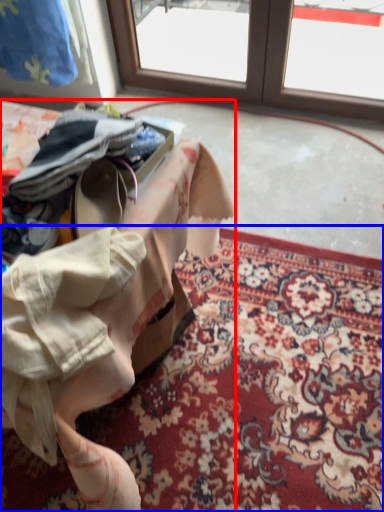
Question: Which object is closer to the camera taking this photo, table (highlighted by a red box) or mat (highlighted by a blue box)?

Choices:
 (A) table
 (B) mat

Answer: (A)